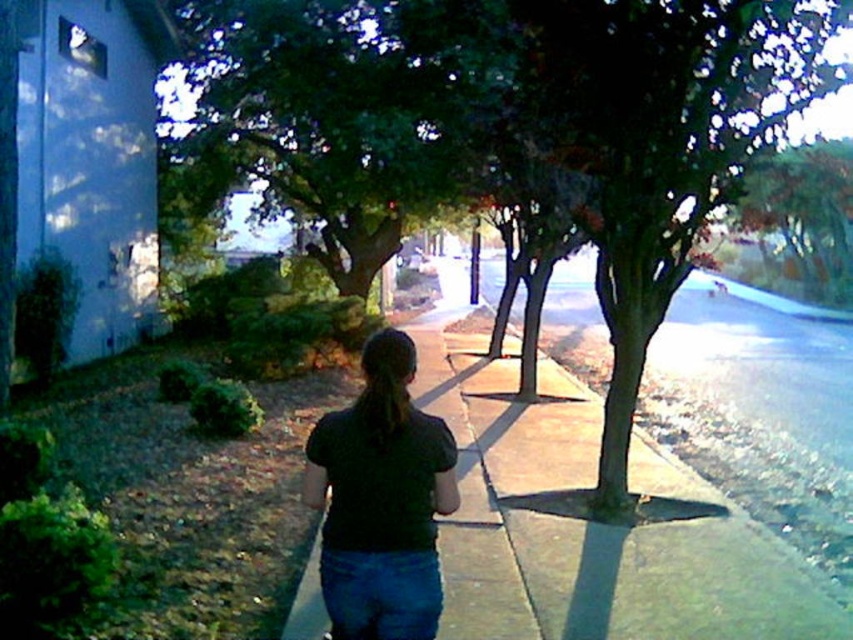
Question: Which of the following is the farthest from the observer?

Choices:
 (A) coord(339,612)
 (B) coord(704,547)

Answer: (B)

Question: Does smooth concrete sidewalk at center have a lesser width compared to blue denim jeans at center?

Choices:
 (A) no
 (B) yes

Answer: (A)

Question: Among these points, which one is farthest from the camera?

Choices:
 (A) coord(434,433)
 (B) coord(326,83)
 (C) coord(412,592)

Answer: (B)

Question: Where is smooth concrete sidewalk at center located in relation to green leafy tree at upper center in the image?

Choices:
 (A) right
 (B) left

Answer: (A)

Question: Which point is closer to the camera?

Choices:
 (A) blue denim jeans at center
 (B) smooth concrete sidewalk at center
 (C) dark matte shirt at center
 (D) green leafy tree at upper center

Answer: (A)

Question: Can you confirm if smooth concrete sidewalk at center is positioned above green leafy tree at upper center?

Choices:
 (A) no
 (B) yes

Answer: (A)